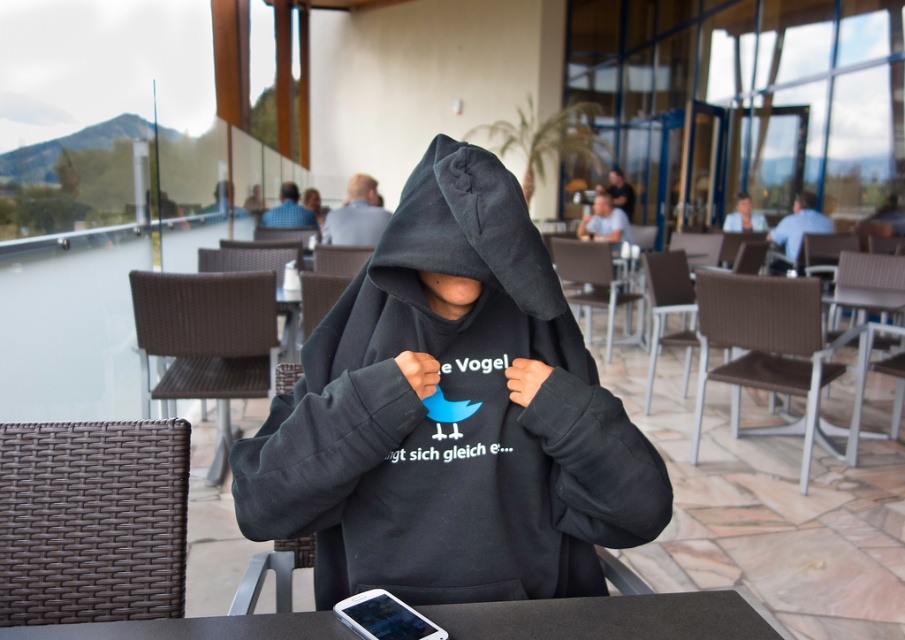
You are a delivery person who needs to place a medium pizza box on the table. Based on the scene, can the pizza box fit on the black matte table at center without overlapping the smooth skin face at upper right?

The black matte table at center has a smaller size compared to smooth skin face at upper right. Since the table is smaller, the pizza box might not fit properly without overlapping the face, so it might not be possible.

You are a delivery person who needs to place a package between the black fleece hoodie at center and the dark gray hoodie at center. The package requires 4 meters of space. Is there enough space between them?

The black fleece hoodie at center is 4.06 meters from dark gray hoodie at center, so yes, there is enough space to place the package between them since the distance is slightly more than 4 meters.

You are a fashion designer observing two hoodies at a modern outdoor seating area. The black fleece hoodie at center and the dark gray hoodie at center are both on display. Which hoodie has a shorter length?

The black fleece hoodie at center is shorter than the dark gray hoodie at center.